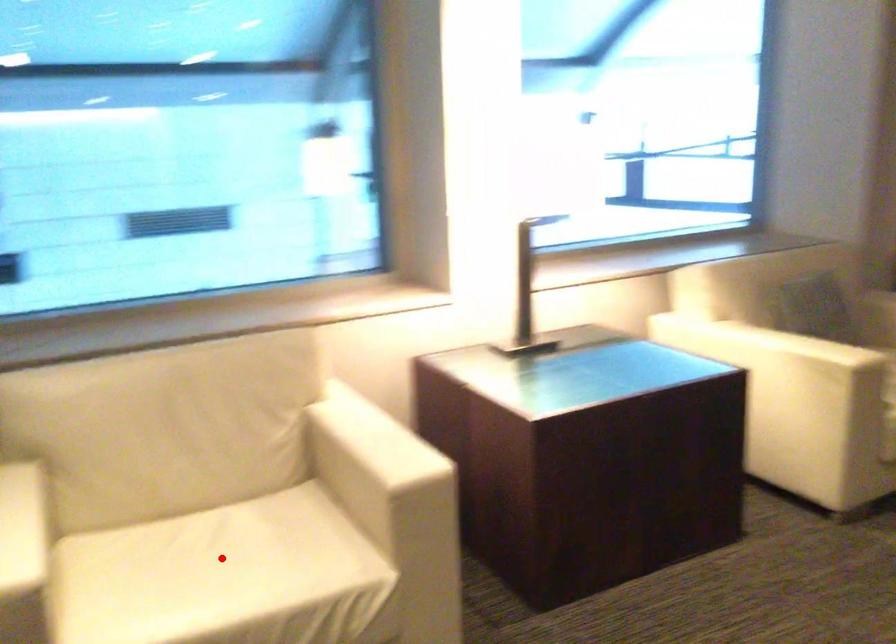
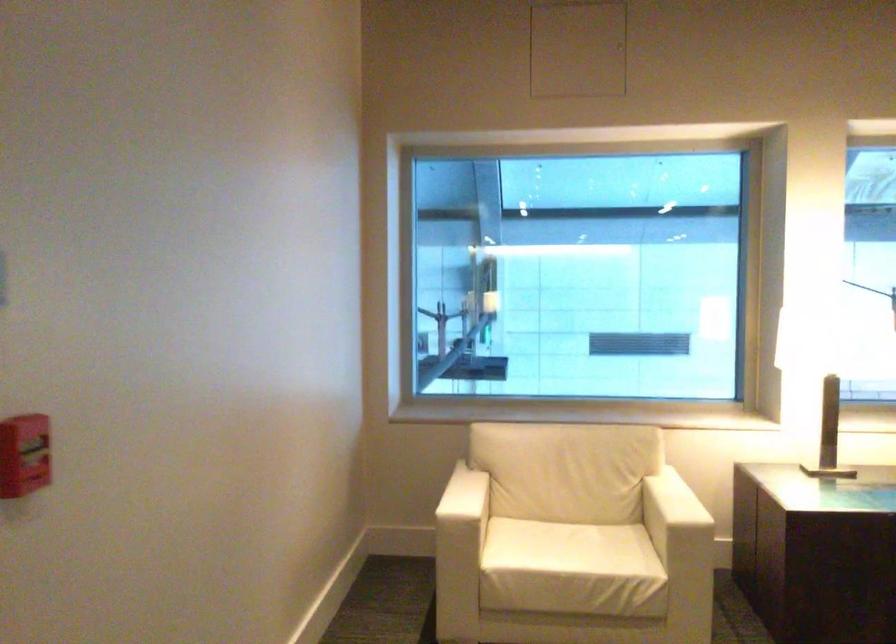
Where in the second image is the point corresponding to the highlighted location from the first image?

(566, 547)